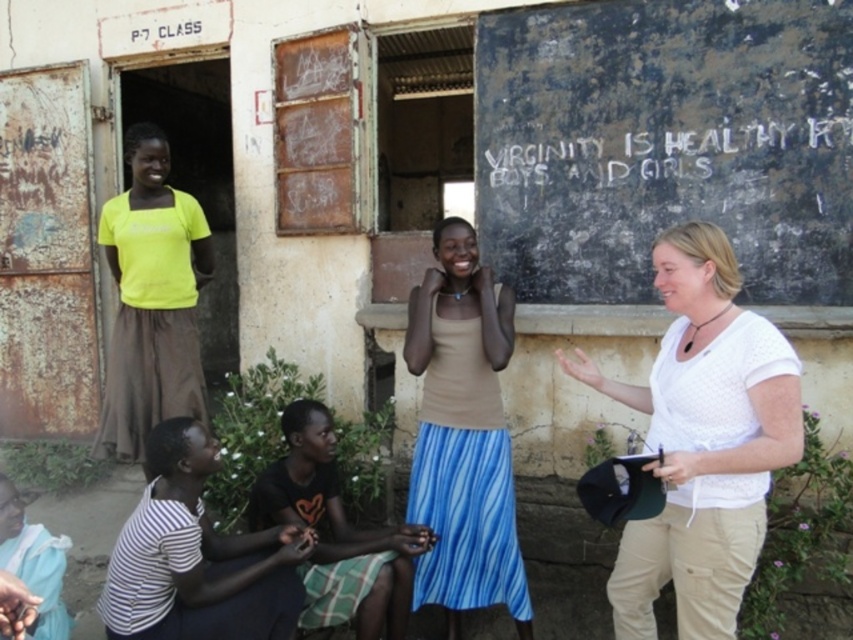
Please describe the position of the white striped shirt at lower left in terms of coordinates within the image frame. The image frame is defined as a coordinate system where the origin is at the bottom left corner, with x increasing to the right and y increasing upward. The coordinates are normalized between 0 and 1. Use the provided object labels exactly as given in the question.

The white striped shirt at lower left is located at coordinates x 0.870 and y 0.232 within the image frame.

You are a photographer trying to capture a photo of the scene. You want to ensure both the white striped shirt at lower left and the white chalk writing at upper center are clearly visible. Which object should you focus on first to ensure proper exposure, considering their sizes?

The white chalk writing at upper center is wider than the white striped shirt at lower left, so focusing on the larger area first might help balance the exposure for both objects.